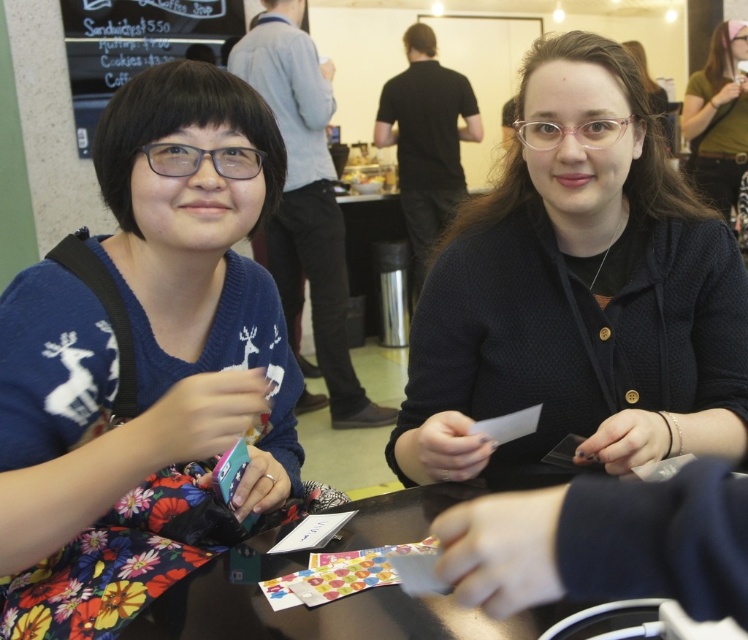
Between green matte shirt at upper right and colorful paper cards at center, which one has more height?

Standing taller between the two is green matte shirt at upper right.

The image size is (748, 640). What do you see at coordinates (717, 118) in the screenshot?
I see `green matte shirt at upper right` at bounding box center [717, 118].

The width and height of the screenshot is (748, 640). I want to click on green matte shirt at upper right, so click(x=717, y=118).

Who is lower down, colorful paper cards at center or white paper at center?

Positioned lower is white paper at center.

Between point (370, 563) and point (310, 536), which one is positioned behind?

Point (310, 536)

Looking at this image, who is more distant from viewer, (x=432, y=545) or (x=346, y=518)?

The point (x=346, y=518) is behind.

What are the coordinates of `colorful paper cards at center` in the screenshot? It's located at (340, 573).

Between green matte shirt at upper right and white paper at center, which one has more height?

Standing taller between the two is green matte shirt at upper right.

Does green matte shirt at upper right have a smaller size compared to white paper at center?

No, green matte shirt at upper right is not smaller than white paper at center.

What are the coordinates of `green matte shirt at upper right` in the screenshot? It's located at (717, 118).